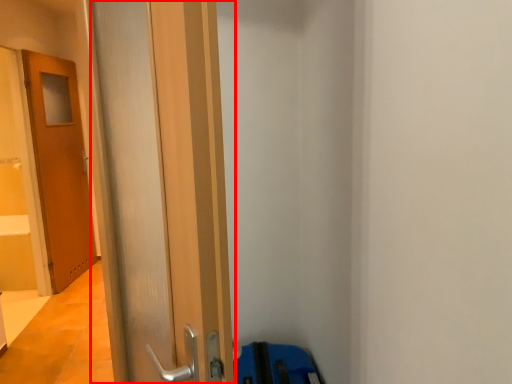
Question: From the image's perspective, what is the correct spatial positioning of door (annotated by the red box) in reference to door?

Choices:
 (A) below
 (B) above

Answer: (A)